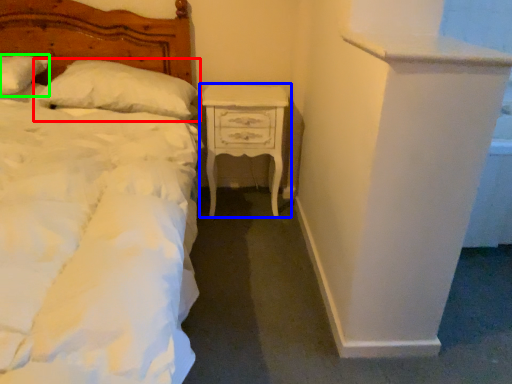
Question: Based on their relative distances, which object is nearer to pillow (highlighted by a red box)? Choose from nightstand (highlighted by a blue box) and pillow (highlighted by a green box).

Choices:
 (A) nightstand
 (B) pillow

Answer: (B)